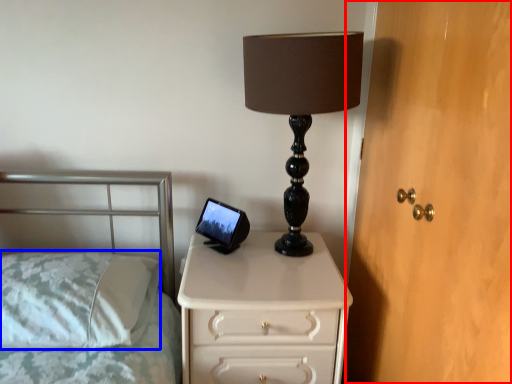
Question: Among these objects, which one is farthest to the camera, dresser (highlighted by a red box) or pillow (highlighted by a blue box)?

Choices:
 (A) dresser
 (B) pillow

Answer: (B)